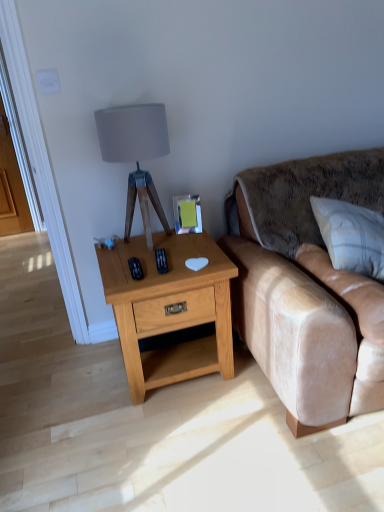
Locate an element on the screen. empty space that is ontop of light oak wood nightstand at center is located at coordinates (160, 247).